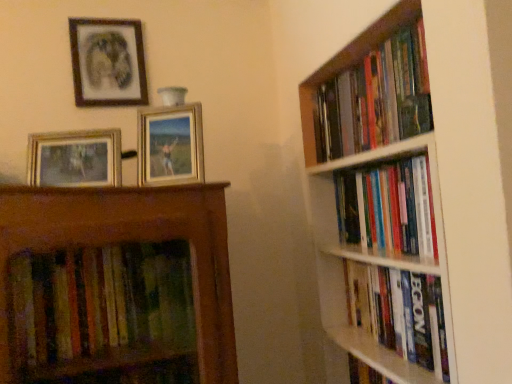
Question: Which direction should I rotate to look at metallic gold picture frame at upper center, marked as the 2th picture frame in a top-to-bottom arrangement, — up or down?

Choices:
 (A) up
 (B) down

Answer: (A)

Question: Is hardcover books at right, marked as the 2th book in a top-to-bottom arrangement, far away from matte black picture frame at upper left, the first picture frame viewed from the back?

Choices:
 (A) yes
 (B) no

Answer: (B)

Question: Is hardcover books at right, placed as the 2th book when sorted from bottom to top, shorter than matte black picture frame at upper left, the first picture frame viewed from the back?

Choices:
 (A) no
 (B) yes

Answer: (B)

Question: From the image's perspective, would you say hardcover books at right, marked as the 2th book in a top-to-bottom arrangement, is positioned over matte black picture frame at upper left, the 3th picture frame positioned from the bottom?

Choices:
 (A) yes
 (B) no

Answer: (B)

Question: Is hardcover books at right, placed as the 2th book when sorted from bottom to top, placed right next to matte black picture frame at upper left, the 3th picture frame viewed from the front?

Choices:
 (A) yes
 (B) no

Answer: (B)

Question: Is matte black picture frame at upper left, the 3th picture frame viewed from the front, completely or partially inside hardcover books at right, placed as the 2th book when sorted from bottom to top?

Choices:
 (A) no
 (B) yes

Answer: (A)

Question: Is hardcover books at right, placed as the 2th book when sorted from bottom to top, taller than matte black picture frame at upper left, the first picture frame viewed from the back?

Choices:
 (A) no
 (B) yes

Answer: (A)

Question: Is hardcover books at right, arranged as the first book when viewed from the top, smaller than gold metallic picture frame at upper left, which is the 1th picture frame from front to back?

Choices:
 (A) yes
 (B) no

Answer: (B)

Question: From the image's perspective, does hardcover books at right, arranged as the first book when viewed from the top, appear lower than gold metallic picture frame at upper left, marked as the 1th picture frame in a bottom-to-top arrangement?

Choices:
 (A) no
 (B) yes

Answer: (A)

Question: From the image's perspective, is hardcover books at right, the 3th book in the bottom-to-top sequence, located above gold metallic picture frame at upper left, which ranks as the third picture frame in back-to-front order?

Choices:
 (A) yes
 (B) no

Answer: (A)

Question: Does hardcover books at right, the 3th book in the bottom-to-top sequence, have a lesser height compared to gold metallic picture frame at upper left, positioned as the 3th picture frame in top-to-bottom order?

Choices:
 (A) no
 (B) yes

Answer: (A)

Question: Is gold metallic picture frame at upper left, which is the 1th picture frame from front to back, at the back of hardcover books at right, arranged as the first book when viewed from the top?

Choices:
 (A) yes
 (B) no

Answer: (B)

Question: From a real-world perspective, is hardcover books at right, arranged as the first book when viewed from the top, located beneath gold metallic picture frame at upper left, which ranks as the third picture frame in back-to-front order?

Choices:
 (A) no
 (B) yes

Answer: (A)

Question: From a real-world perspective, is hardcover book at right, which ranks as the third book in top-to-bottom order, located higher than hardcover books at right, placed as the 2th book when sorted from bottom to top?

Choices:
 (A) yes
 (B) no

Answer: (B)